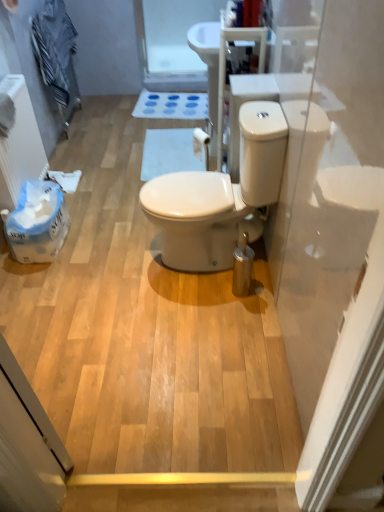
At what (x,y) coordinates should I click in order to perform the action: click on blank space to the left of white glossy toilet at center. Please return your answer as a coordinate pair (x, y). The height and width of the screenshot is (512, 384). Looking at the image, I should click on (113, 262).